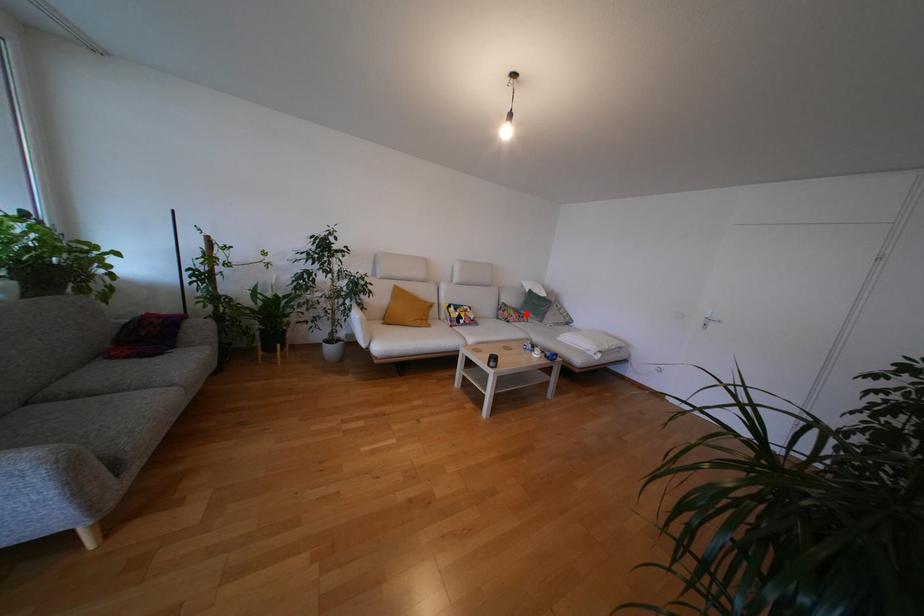
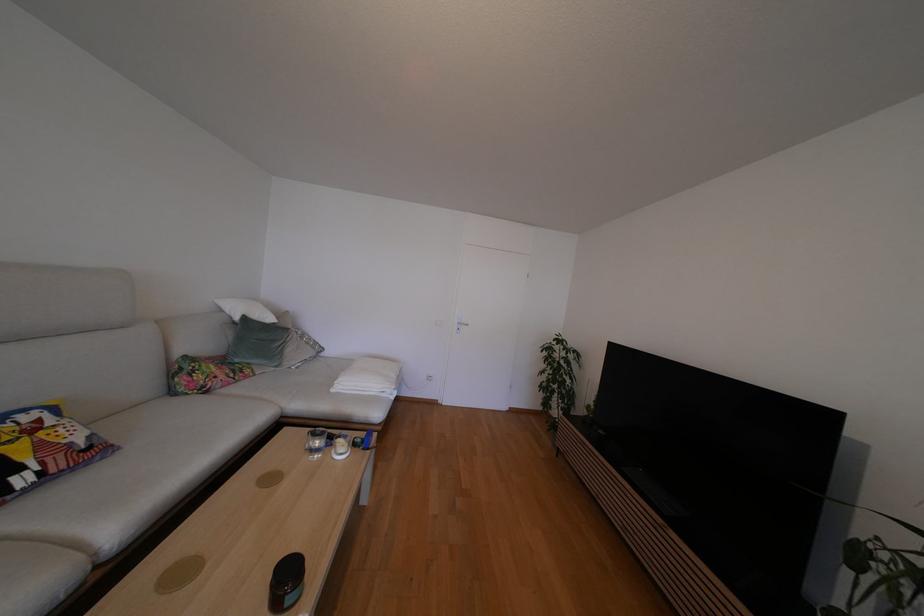
Find the pixel in the second image that matches the highlighted location in the first image.

(241, 363)